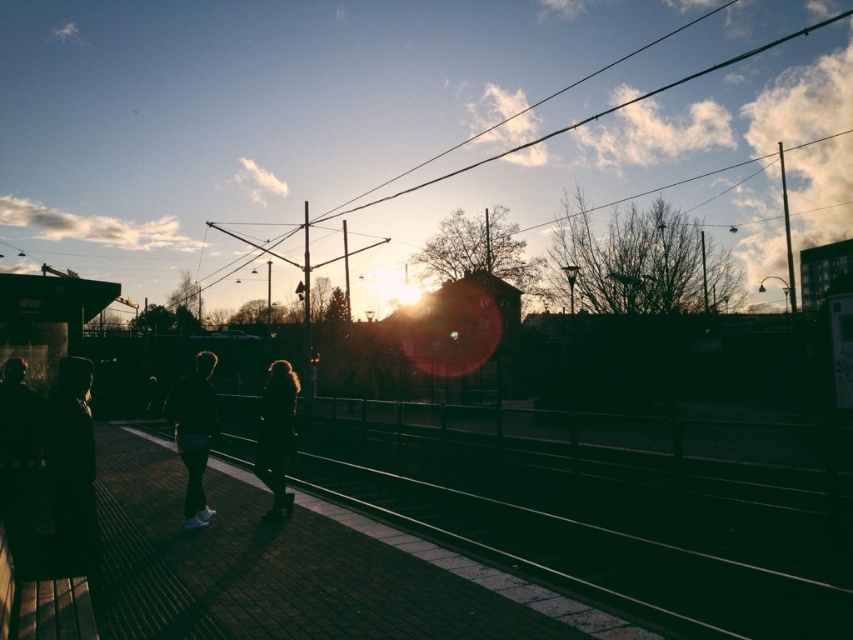
This screenshot has height=640, width=853. Describe the element at coordinates (73, 460) in the screenshot. I see `silhouette jacket at left` at that location.

Does silhouette jacket at left appear on the right side of silhouette hair at center?

In fact, silhouette jacket at left is to the left of silhouette hair at center.

Who is more distant from viewer, (90, 413) or (262, 451)?

The point (262, 451) is behind.

What are the coordinates of `silhouette jacket at left` in the screenshot? It's located at (73, 460).

Can you confirm if black wire at upper center is taller than silhouette hair at center?

Yes.

Who is positioned more to the right, black wire at upper center or silhouette hair at center?

From the viewer's perspective, black wire at upper center appears more on the right side.

Who is more distant from viewer, (380, 200) or (270, 442)?

The point (380, 200) is more distant.

The height and width of the screenshot is (640, 853). I want to click on black wire at upper center, so click(x=579, y=120).

Between dark clothing at left and silhouette hair at center, which one has more height?

silhouette hair at center

Is dark clothing at left to the left of silhouette hair at center from the viewer's perspective?

Yes, dark clothing at left is to the left of silhouette hair at center.

Where is `dark clothing at left`? This screenshot has height=640, width=853. dark clothing at left is located at coordinates (16, 452).

The image size is (853, 640). Find the location of `dark clothing at left`. dark clothing at left is located at coordinates (16, 452).